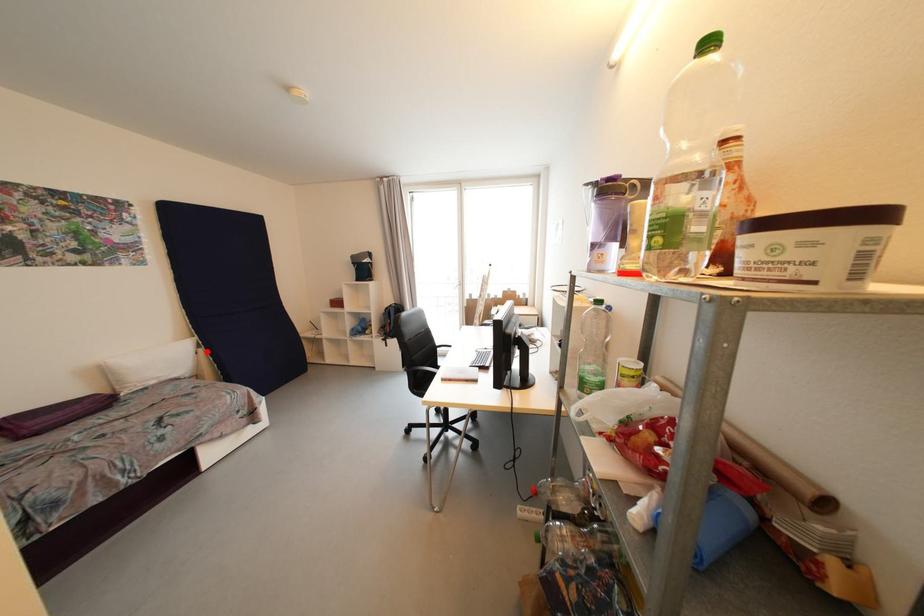
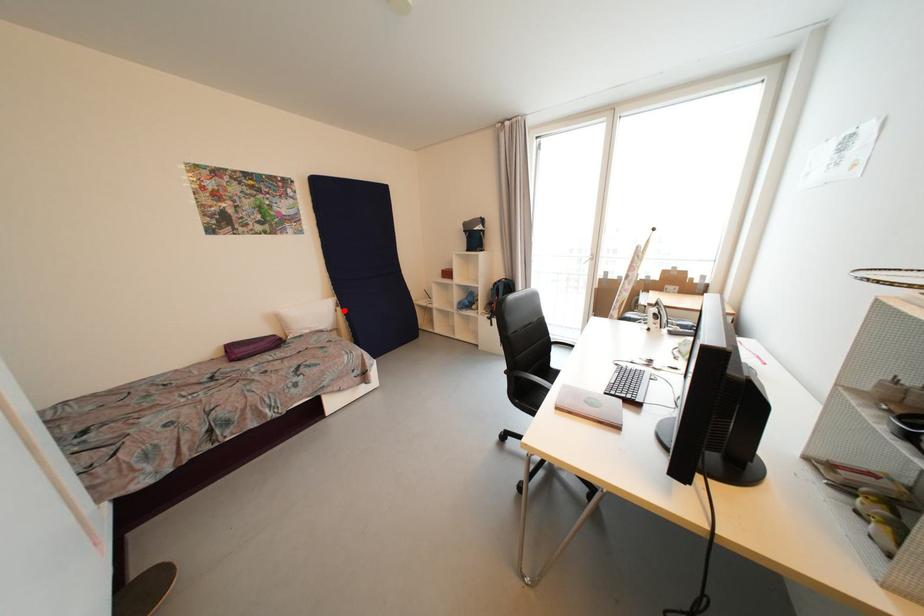
I am providing you with two images of the same scene from different viewpoints. A red point is marked on the first image and another point is marked on the second image. Do the highlighted points in image1 and image2 indicate the same real-world spot?

Yes